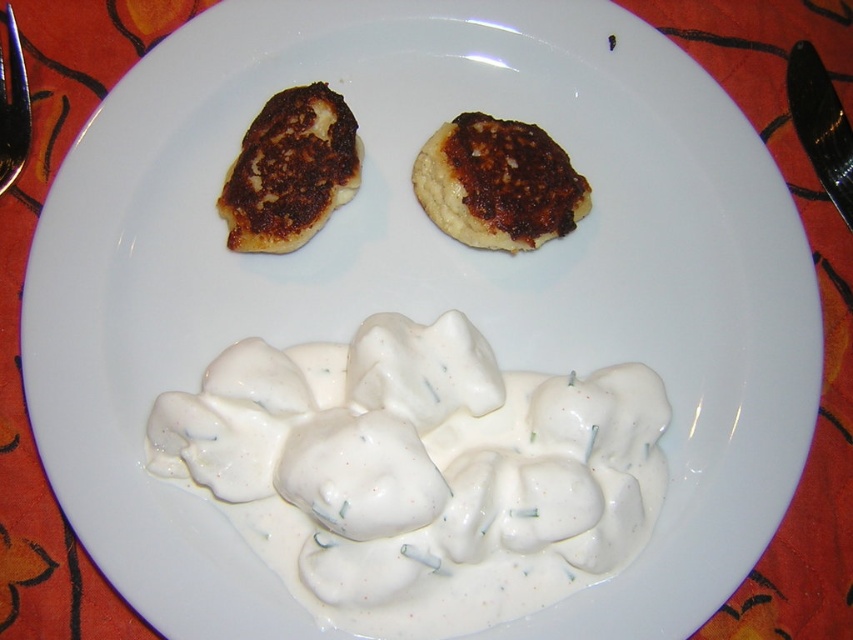
You are a chef trying to determine the best way to present a new dish. You have two points on the plate where you can place garnishes. The first is at point (347, 124), and the second is at point (20, 150). Which point is closer to the viewer and would be better for placing a decorative herb sprig that needs to stand out?

Point (347, 124) is further to the viewer than point (20, 150). Therefore, placing the decorative herb sprig at point (20, 150) would be closer to the viewer and better for making it stand out.

You are a food critic who wants to taste the brown crispy pancake at upper left and the metallic silver fork at upper left. Which one is taller?

The brown crispy pancake at upper left is not as tall as the metallic silver fork at upper left, so the metallic silver fork at upper left is taller.

You are a diner who wants to eat the brown crispy pancake at upper center. The metallic silver fork at upper left is the only utensil available. Can you reach the pancake with the fork without moving the fork?

The metallic silver fork at upper left is behind the brown crispy pancake at upper center, so you cannot reach the pancake with the fork without moving the fork.